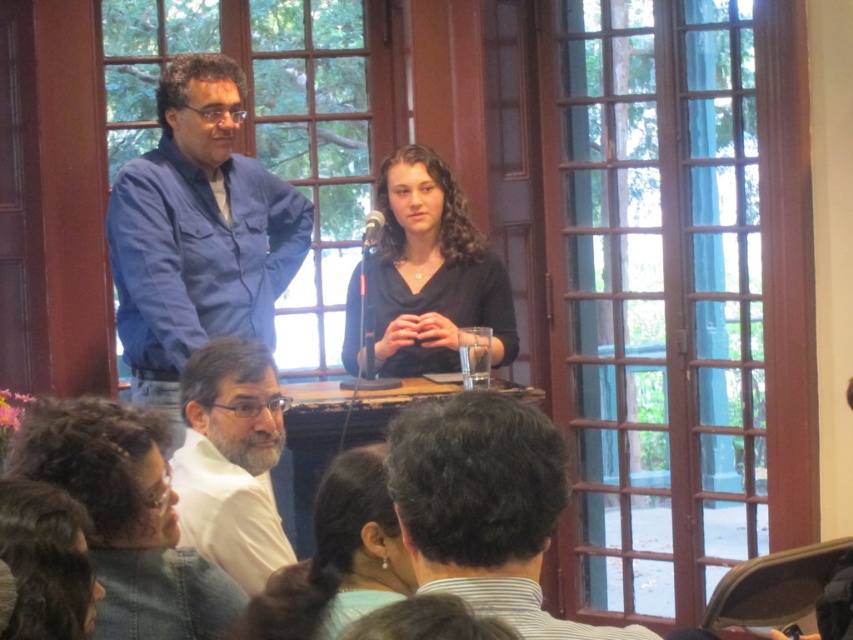
Question: Is dark brown hair at center bigger than matte black hair at lower center?

Choices:
 (A) yes
 (B) no

Answer: (A)

Question: Does dark brown hair at center have a smaller size compared to white matte shirt at lower left?

Choices:
 (A) yes
 (B) no

Answer: (A)

Question: Which object is the closest to the black matte shirt at center?

Choices:
 (A) blue cotton shirt at upper left
 (B) matte black hair at lower center
 (C) white matte shirt at lower left

Answer: (A)

Question: Which of the following is the farthest from the observer?

Choices:
 (A) coord(250,560)
 (B) coord(550,624)
 (C) coord(329,515)
 (D) coord(149,502)

Answer: (A)

Question: Can you confirm if blue cotton shirt at upper left is thinner than dark brown hair at center?

Choices:
 (A) yes
 (B) no

Answer: (B)

Question: Which of these objects is positioned farthest from the matte black hair at lower center?

Choices:
 (A) dark brown hair at center
 (B) white matte shirt at lower left
 (C) matte black hair at lower left
 (D) black matte shirt at center

Answer: (D)